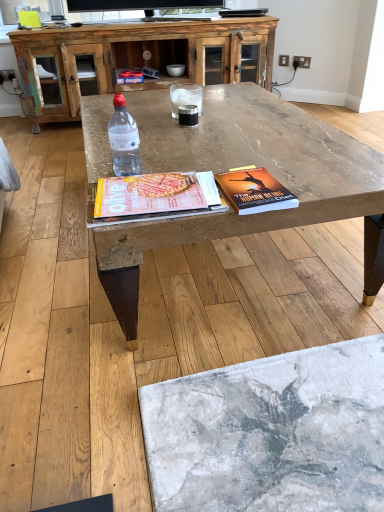
The width and height of the screenshot is (384, 512). What are the coordinates of `vacant space that is in between matte paper magazine at center and black rubberized cup at center` in the screenshot? It's located at (178, 152).